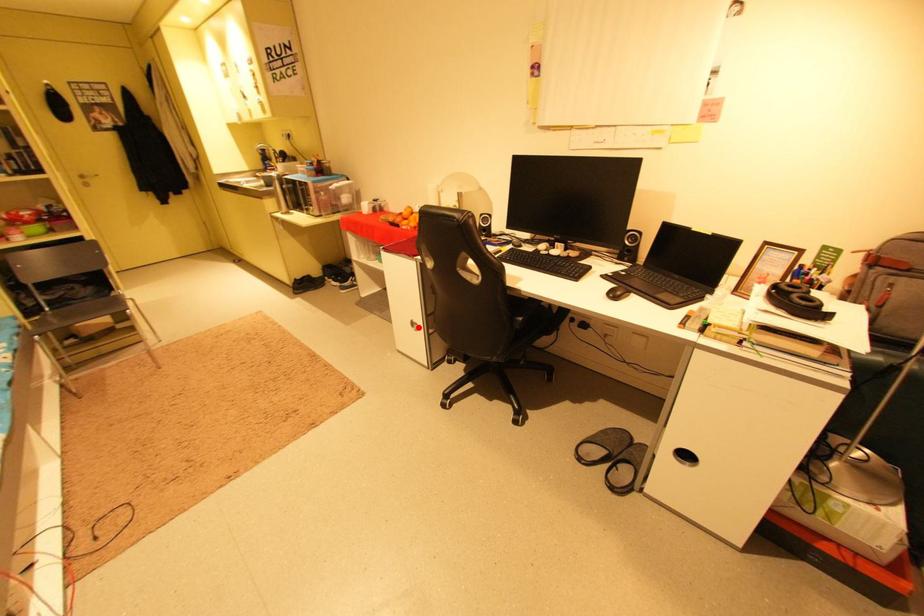
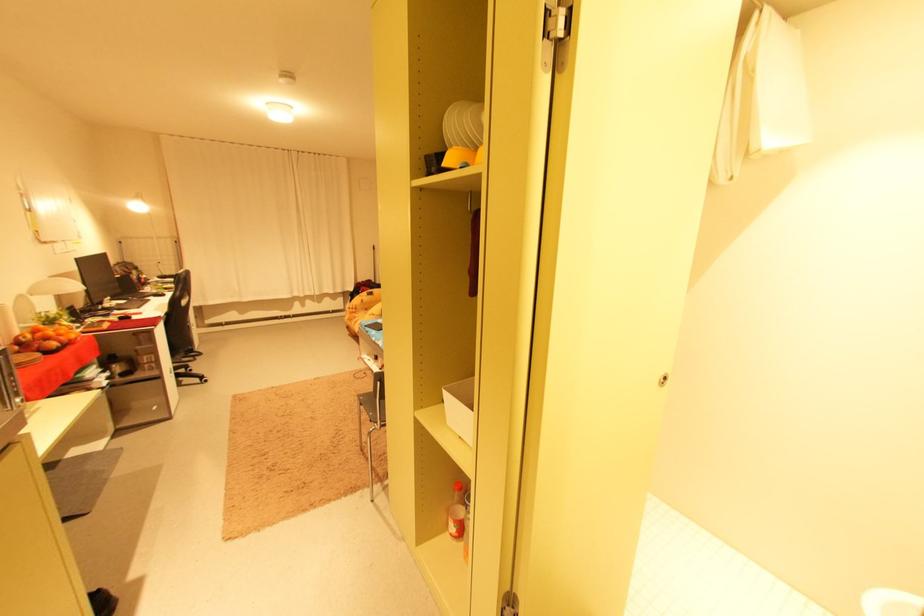
Question: I am providing you with two images of the same scene from different viewpoints. A red point is shown in image1. For the corresponding object point in image2, is it positioned nearer or farther from the camera?

Choices:
 (A) Nearer
 (B) Farther

Answer: (A)